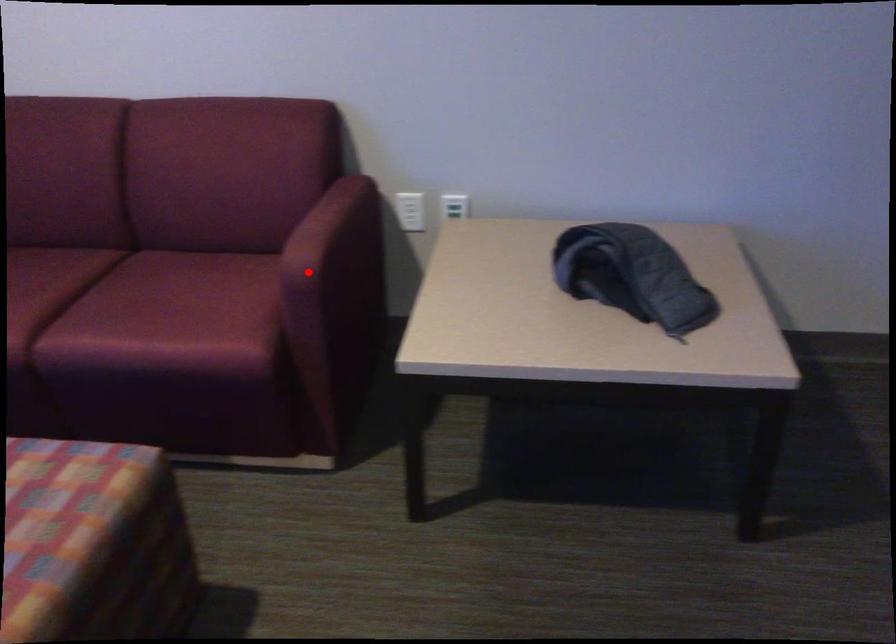
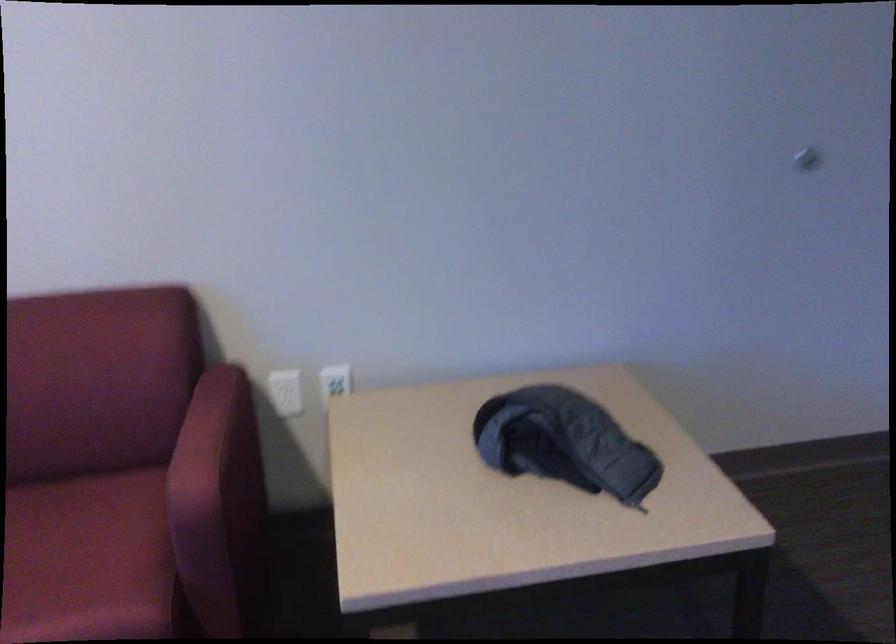
Question: I am providing you with two images of the same scene from different viewpoints. Given a red point in image1, look at the same physical point in image2. Is it:

Choices:
 (A) Closer to the viewpoint
 (B) Farther from the viewpoint

Answer: (A)